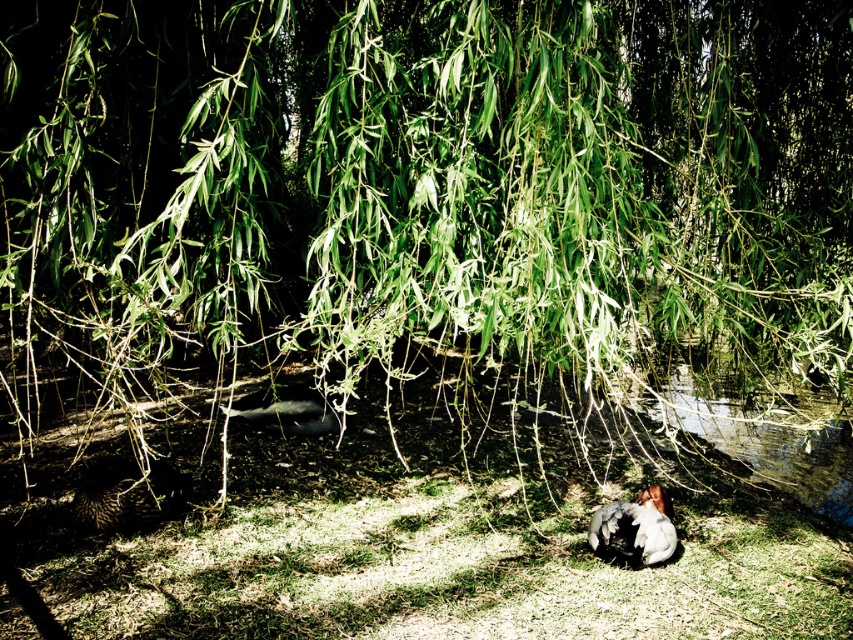
Question: Which is nearer to the speckled feathered bird at lower center?

Choices:
 (A) brown fuzzy bird at center
 (B) brown speckled bird at lower left

Answer: (B)

Question: Which object is positioned closest to the brown fuzzy bird at center?

Choices:
 (A) speckled feathered bird at lower center
 (B) brown speckled bird at lower left

Answer: (B)

Question: Is speckled feathered bird at lower center further to the viewer compared to brown fuzzy bird at center?

Choices:
 (A) no
 (B) yes

Answer: (A)

Question: Does brown speckled bird at lower left appear on the right side of speckled feathered bird at lower center?

Choices:
 (A) no
 (B) yes

Answer: (A)

Question: Among these points, which one is farthest from the camera?

Choices:
 (A) pos(645,504)
 (B) pos(167,497)

Answer: (A)

Question: Considering the relative positions of brown speckled bird at lower left and speckled feathered bird at lower center in the image provided, where is brown speckled bird at lower left located with respect to speckled feathered bird at lower center?

Choices:
 (A) right
 (B) left

Answer: (B)